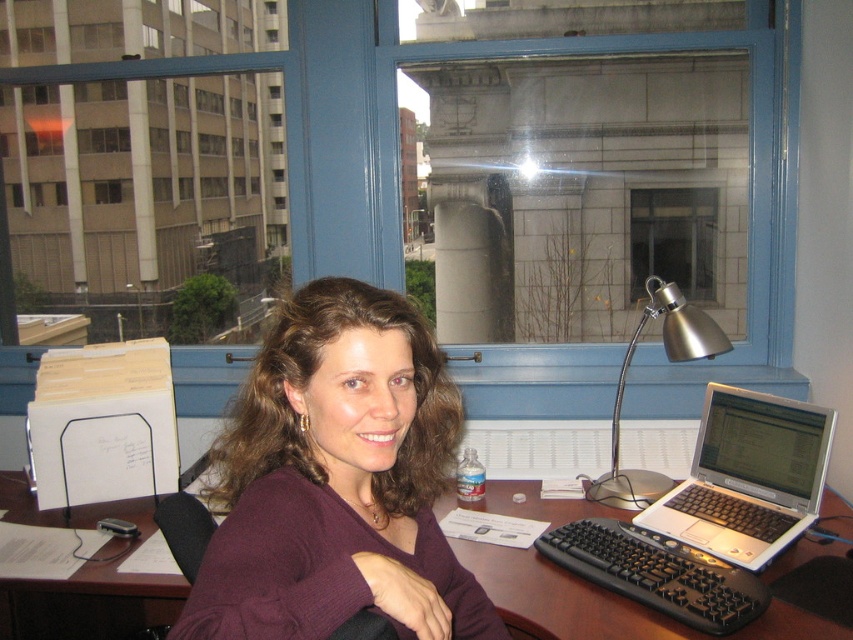
You are standing in front of the desk and want to reach the point that is closer to you. Which point should you move towards, point at (683, 492) or point at (659, 244)?

Point at (683, 492) is in front of point at (659, 244), so you should move towards point at (683, 492) to reach the one closer to you.

Consider the image. You are organizing the desk and need to place a new item on the brown wooden table at center. However, there is a satin silver desk lamp at right casting a shadow over part of the table. Can you place the item in an area not covered by the shadow?

The brown wooden table at center is positioned under the satin silver desk lamp at right. Since the lamp is above the table, its shadow would likely cover most of the table surface. Therefore, it might be challenging to find an area not covered by the shadow to place the item.